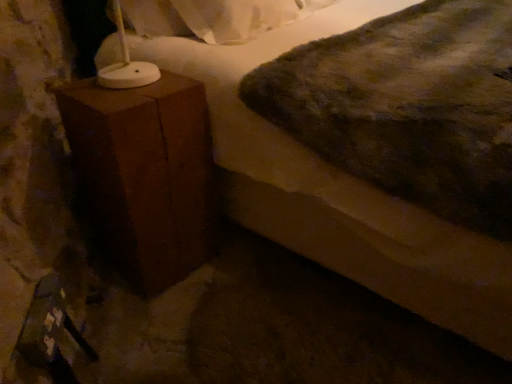
The image size is (512, 384). Find the location of `vacant area that is in front of brown wood side table at left`. vacant area that is in front of brown wood side table at left is located at coordinates (146, 313).